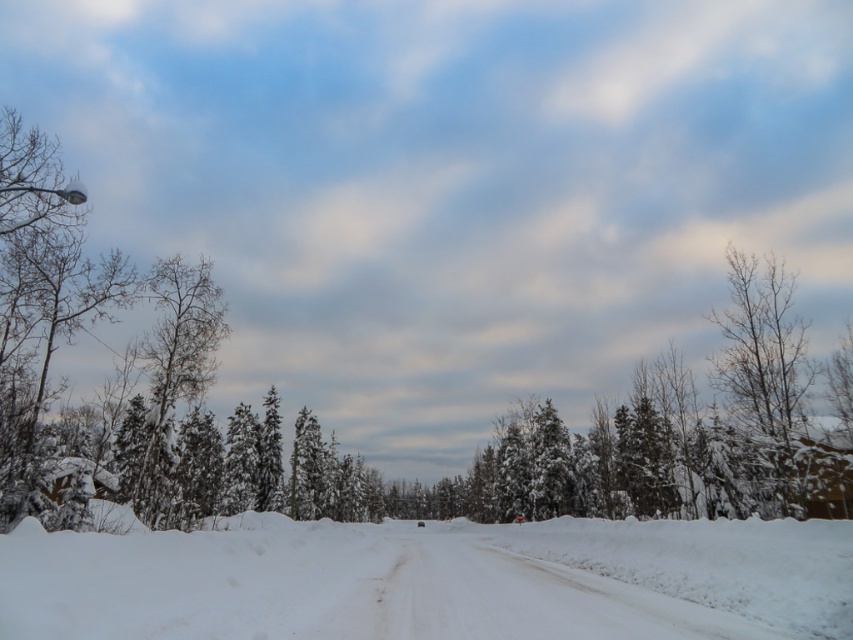
You are standing at the point marked by the coordinates point (432, 579) in the snowy landscape. What is the immediate surface beneath your feet?

The immediate surface beneath your feet at point (432, 579) is white fluffy snow at center, as indicated by the coordinates provided.

You are a snowplow operator needing to clear the road. You notice the white fluffy snow at center and the bare branches at right. Which area requires immediate attention to ensure the road remains passable?

The white fluffy snow at center requires immediate attention because it is thinner than the bare branches at right, meaning it might be more prone to drifting or compaction under vehicle traffic, potentially obstructing the road more quickly.

You are a hiker trying to navigate through the snowy road. You notice the white fluffy snow at center and the bare branches at right. Which one is closer to the ground?

The white fluffy snow at center is closer to the ground because it is located below the bare branches at right.